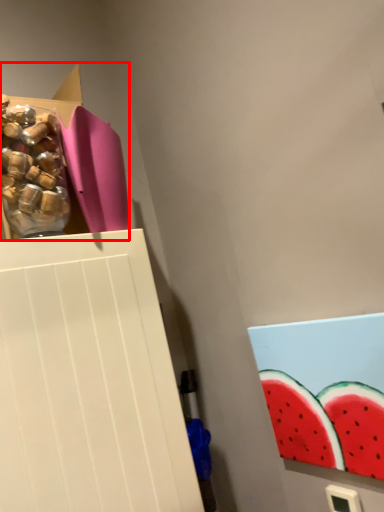
Question: From the image's perspective, what is the correct spatial relationship of storage box (annotated by the red box) in relation to food?

Choices:
 (A) above
 (B) below

Answer: (A)